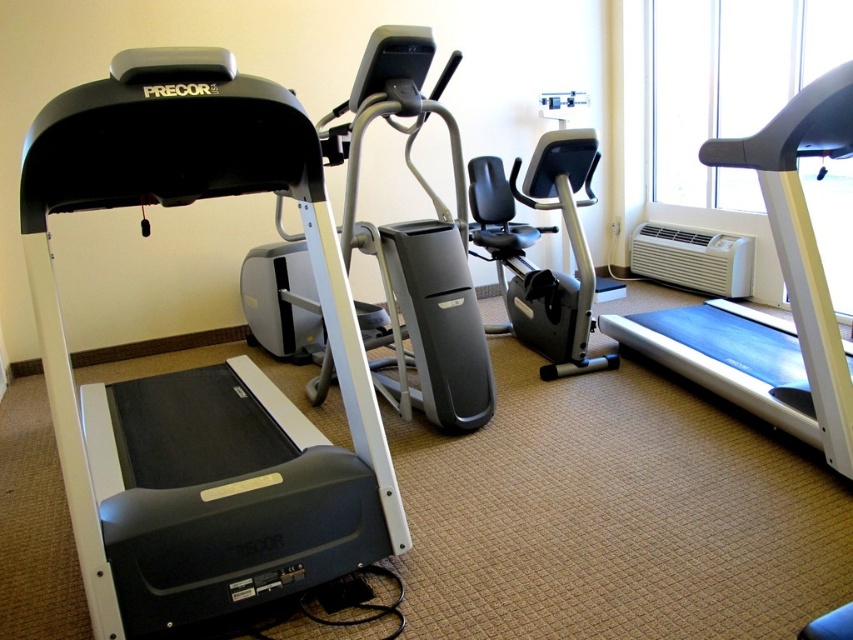
You are standing at the entrance of the gym and want to locate the elliptical machine. You see a point marked at coordinates [200,368]. Which direction should you move relative to the point to find the elliptical machine?

The point at [200,368] corresponds to the matte black treadmill at left. Since the elliptical machine is to the right of the treadmill, you should move to the right of the point to locate the elliptical machine.

You are standing at point (149, 54) in the gym. You want to grab a water bottle from the treadmill control panel. Can you reach it without moving from your current position?

The distance between point (149, 54) and the camera is 1.55 meters. Since the treadmill control panel is at the front of the treadmill, which is in the foreground, you would need to be closer than 1.55 meters to reach it. Therefore, you cannot reach the control panel from your current position.